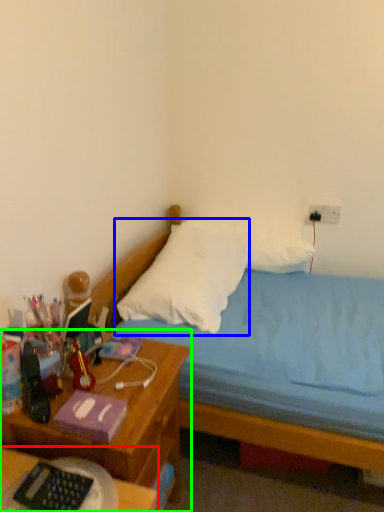
Question: Which is farther away from desk (highlighted by a red box)? pillow (highlighted by a blue box) or nightstand (highlighted by a green box)?

Choices:
 (A) pillow
 (B) nightstand

Answer: (A)